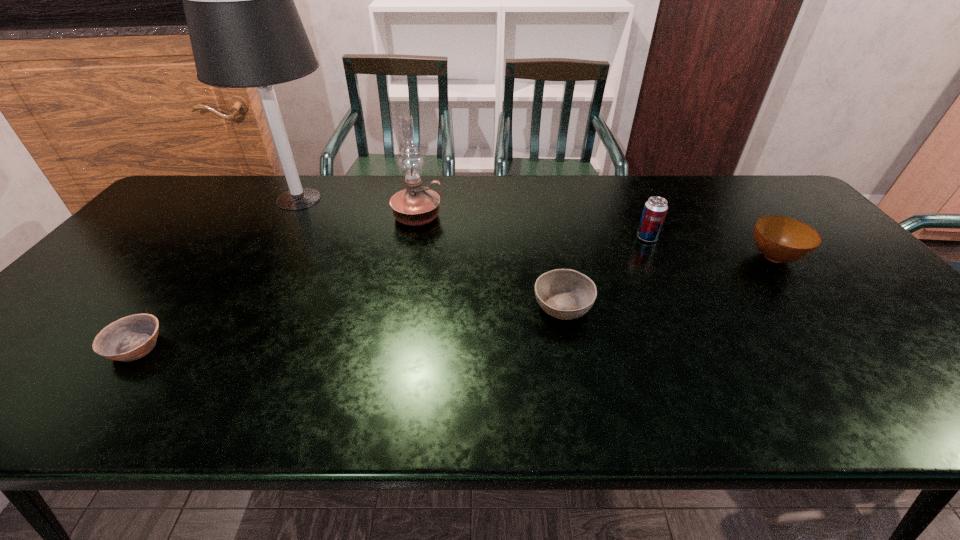
In the image, there is a desktop. Identify the location of vacant space at the far edge. (564, 207).

You are a GUI agent. You are given a task and a screenshot of the screen. Output one action in this format:
    pyautogui.click(x=<x>, y=<y>)
    Task: Click on the blank area at the near edge
    The image size is (960, 540).
    Given the screenshot: What is the action you would take?
    pyautogui.click(x=517, y=388)

Find the location of a particular element. vacant area at the left edge of the desktop is located at coordinates (169, 225).

Identify the location of free location at the right edge. This screenshot has width=960, height=540. (828, 281).

This screenshot has height=540, width=960. In order to click on free location at the far right corner of the desktop in this screenshot , I will do `click(758, 181)`.

Find the location of a particular element. The height and width of the screenshot is (540, 960). free area in between the fifth object from left to right and the second tallest object is located at coordinates (532, 227).

You are a GUI agent. You are given a task and a screenshot of the screen. Output one action in this format:
    pyautogui.click(x=<x>, y=<y>)
    Task: Click on the free space between the second object from right to left and the table lamp
    The width and height of the screenshot is (960, 540).
    Given the screenshot: What is the action you would take?
    [x=473, y=218]

Where is `free space between the oil lamp and the second object from right to left`? This screenshot has width=960, height=540. free space between the oil lamp and the second object from right to left is located at coordinates (532, 227).

Where is `free spot between the farthest bowl and the tallest object`? free spot between the farthest bowl and the tallest object is located at coordinates (537, 228).

The height and width of the screenshot is (540, 960). I want to click on vacant region between the fifth tallest object and the third object from left to right, so click(x=491, y=261).